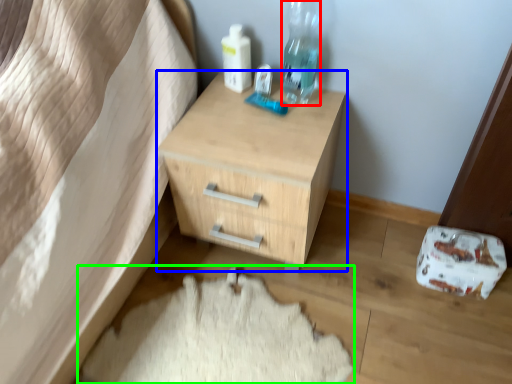
Question: Considering the real-world distances, which object is farthest from bottle (highlighted by a red box)? chest of drawers (highlighted by a blue box) or sheet (highlighted by a green box)?

Choices:
 (A) chest of drawers
 (B) sheet

Answer: (B)